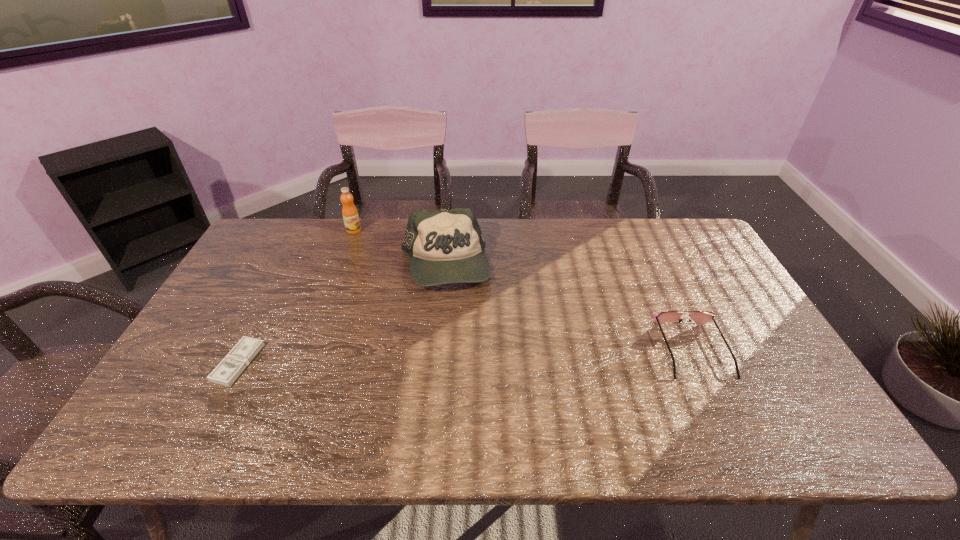
Find the location of a particular element. vacant space on the desktop that is between the shortest object and the rightmost object and is positioned on the front-facing side of the third nearest object is located at coordinates [438, 357].

Identify the location of vacant space on the desktop that is between the shortest object and the sunglasses and is positioned on the front label of the tallest object. The image size is (960, 540). (407, 358).